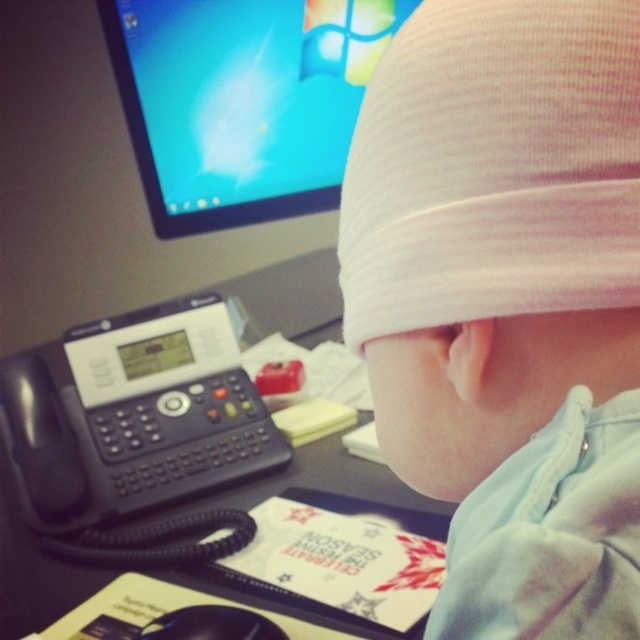
Question: Can you confirm if white fabric hat at upper center is smaller than black plastic phone at left?

Choices:
 (A) yes
 (B) no

Answer: (A)

Question: Can you confirm if matte plastic monitor at upper center is positioned below black plastic phone at lower left?

Choices:
 (A) yes
 (B) no

Answer: (B)

Question: Estimate the real-world distances between objects in this image. Which object is farther from the white fabric hat at upper center?

Choices:
 (A) black plastic phone at lower left
 (B) matte plastic monitor at upper center

Answer: (B)

Question: Based on their relative distances, which object is farther from the black plastic phone at left?

Choices:
 (A) black plastic phone at lower left
 (B) matte plastic monitor at upper center
 (C) white fabric hat at upper center

Answer: (C)

Question: Which of the following is the farthest from the observer?

Choices:
 (A) matte plastic monitor at upper center
 (B) black plastic phone at lower left

Answer: (A)

Question: Is white fabric hat at upper center bigger than black plastic phone at lower left?

Choices:
 (A) yes
 (B) no

Answer: (B)